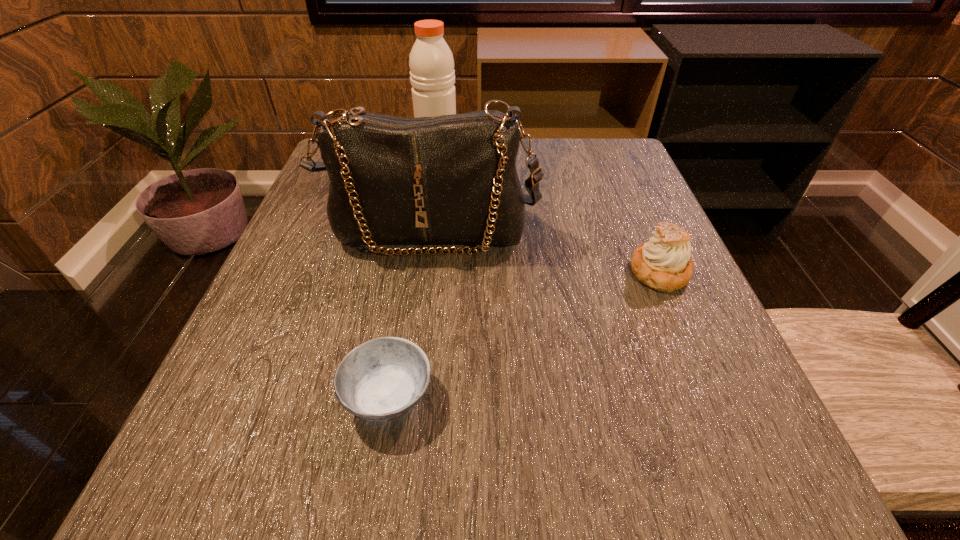
You are a GUI agent. You are given a task and a screenshot of the screen. Output one action in this format:
    pyautogui.click(x=<x>, y=<y>)
    Task: Click on the free space between the handbag and the ashtray
    
    Given the screenshot: What is the action you would take?
    pyautogui.click(x=409, y=314)

You are a GUI agent. You are given a task and a screenshot of the screen. Output one action in this format:
    pyautogui.click(x=<x>, y=<y>)
    Task: Click on the vacant area that lies between the ashtray and the shaker
    
    Given the screenshot: What is the action you would take?
    pyautogui.click(x=414, y=275)

Locate an element on the screen. free spot between the rightmost object and the handbag is located at coordinates (544, 252).

This screenshot has width=960, height=540. I want to click on free space that is in between the handbag and the nearest object, so click(x=409, y=314).

At what (x,y) coordinates should I click in order to perform the action: click on empty location between the shortest object and the rightmost object. Please return your answer as a coordinate pair (x, y). The height and width of the screenshot is (540, 960). Looking at the image, I should click on (524, 334).

You are a GUI agent. You are given a task and a screenshot of the screen. Output one action in this format:
    pyautogui.click(x=<x>, y=<y>)
    Task: Click on the vacant point located between the shortest object and the rightmost object
    
    Given the screenshot: What is the action you would take?
    pyautogui.click(x=524, y=334)

You are a GUI agent. You are given a task and a screenshot of the screen. Output one action in this format:
    pyautogui.click(x=<x>, y=<y>)
    Task: Click on the empty space that is in between the pastry and the handbag
    The image size is (960, 540).
    Given the screenshot: What is the action you would take?
    pyautogui.click(x=544, y=252)

You are a GUI agent. You are given a task and a screenshot of the screen. Output one action in this format:
    pyautogui.click(x=<x>, y=<y>)
    Task: Click on the free space between the pastry and the handbag
    The width and height of the screenshot is (960, 540).
    Given the screenshot: What is the action you would take?
    pyautogui.click(x=544, y=252)

Where is `object that ranks as the second closest to the ashtray`? The width and height of the screenshot is (960, 540). object that ranks as the second closest to the ashtray is located at coordinates (663, 263).

Select which object is the third closest to the ashtray. Please provide its 2D coordinates. Your answer should be formatted as a tuple, i.e. [(x, y)], where the tuple contains the x and y coordinates of a point satisfying the conditions above.

[(432, 75)]